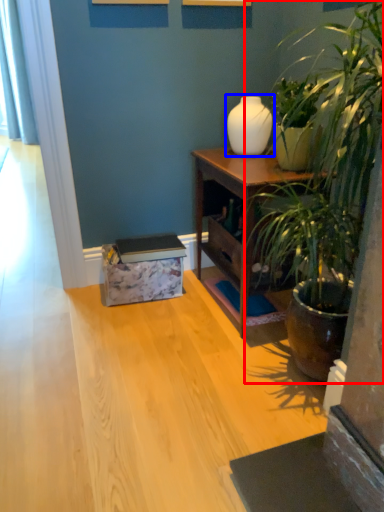
Question: Among these objects, which one is nearest to the camera, houseplant (highlighted by a red box) or vase (highlighted by a blue box)?

Choices:
 (A) houseplant
 (B) vase

Answer: (A)